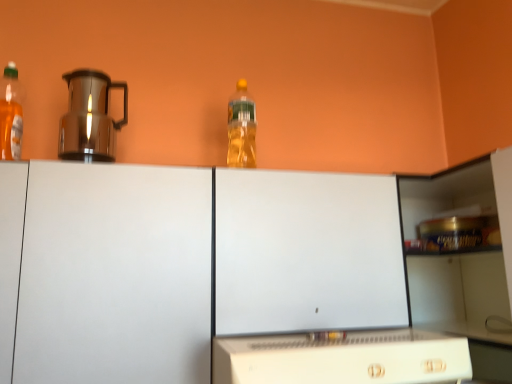
Question: Is white plastic microwave at lower center at the right side of shiny metallic coffee pot at left?

Choices:
 (A) yes
 (B) no

Answer: (A)

Question: Is white plastic microwave at lower center not near shiny metallic coffee pot at left?

Choices:
 (A) yes
 (B) no

Answer: (B)

Question: Can you confirm if white plastic microwave at lower center is smaller than shiny metallic coffee pot at left?

Choices:
 (A) yes
 (B) no

Answer: (B)

Question: Is white plastic microwave at lower center beside shiny metallic coffee pot at left?

Choices:
 (A) yes
 (B) no

Answer: (B)

Question: Is white plastic microwave at lower center in front of shiny metallic coffee pot at left?

Choices:
 (A) no
 (B) yes

Answer: (B)

Question: In terms of height, does translucent plastic bottle at upper center, the second bottle when ordered from front to back, look taller or shorter compared to shiny metallic coffee pot at left?

Choices:
 (A) tall
 (B) short

Answer: (A)

Question: Visually, is translucent plastic bottle at upper center, the second bottle when ordered from front to back, positioned to the left or to the right of shiny metallic coffee pot at left?

Choices:
 (A) right
 (B) left

Answer: (A)

Question: From a real-world perspective, is translucent plastic bottle at upper center, placed as the second bottle when sorted from left to right, positioned above or below shiny metallic coffee pot at left?

Choices:
 (A) below
 (B) above

Answer: (B)

Question: Considering their positions, is translucent plastic bottle at upper center, placed as the second bottle when sorted from left to right, located in front of or behind shiny metallic coffee pot at left?

Choices:
 (A) front
 (B) behind

Answer: (B)

Question: In the image, is white plastic microwave at lower center on the left side or the right side of white matte cabinet at center?

Choices:
 (A) right
 (B) left

Answer: (A)

Question: In terms of width, does white plastic microwave at lower center look wider or thinner when compared to white matte cabinet at center?

Choices:
 (A) thin
 (B) wide

Answer: (B)

Question: Considering the positions of white plastic microwave at lower center and white matte cabinet at center in the image, is white plastic microwave at lower center taller or shorter than white matte cabinet at center?

Choices:
 (A) tall
 (B) short

Answer: (B)

Question: From the image's perspective, is white plastic microwave at lower center located above or below white matte cabinet at center?

Choices:
 (A) above
 (B) below

Answer: (B)

Question: Considering the positions of point (138, 342) and point (232, 148), is point (138, 342) closer or farther from the camera than point (232, 148)?

Choices:
 (A) farther
 (B) closer

Answer: (B)

Question: Relative to translucent plastic bottle at upper center, placed as the 1th bottle when sorted from right to left, is white matte cabinet at center in front or behind?

Choices:
 (A) front
 (B) behind

Answer: (A)